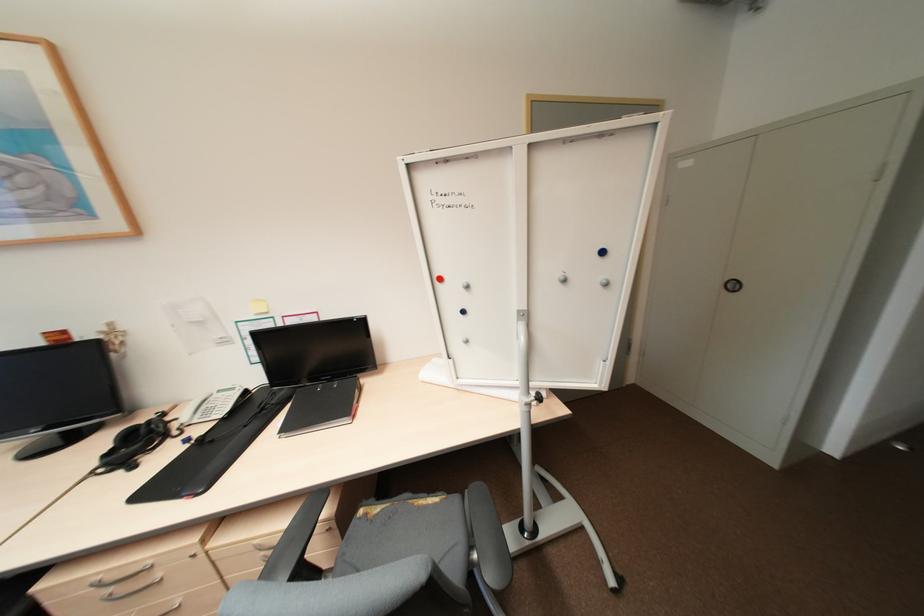
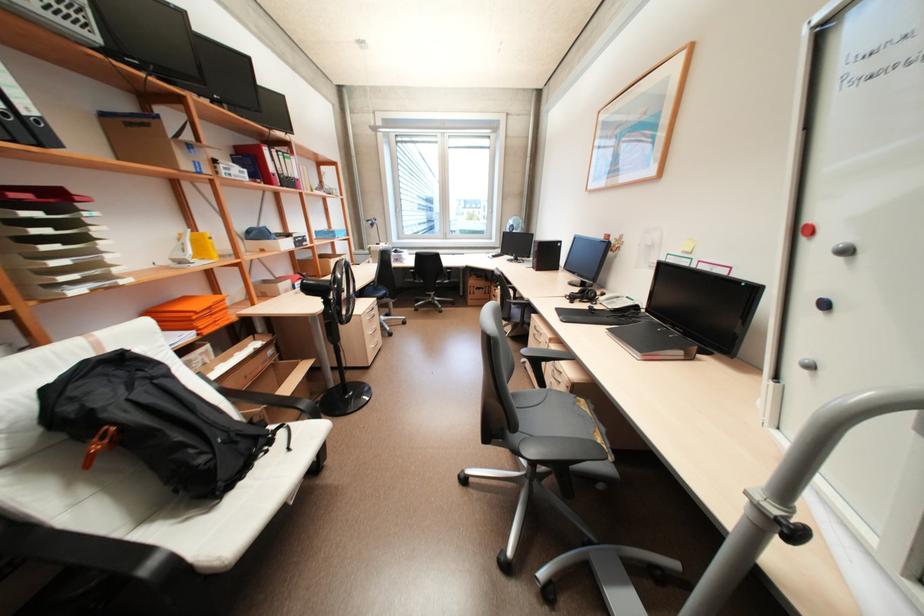
Locate, in the second image, the point that corresponds to point 468,312 in the first image.

(830, 304)